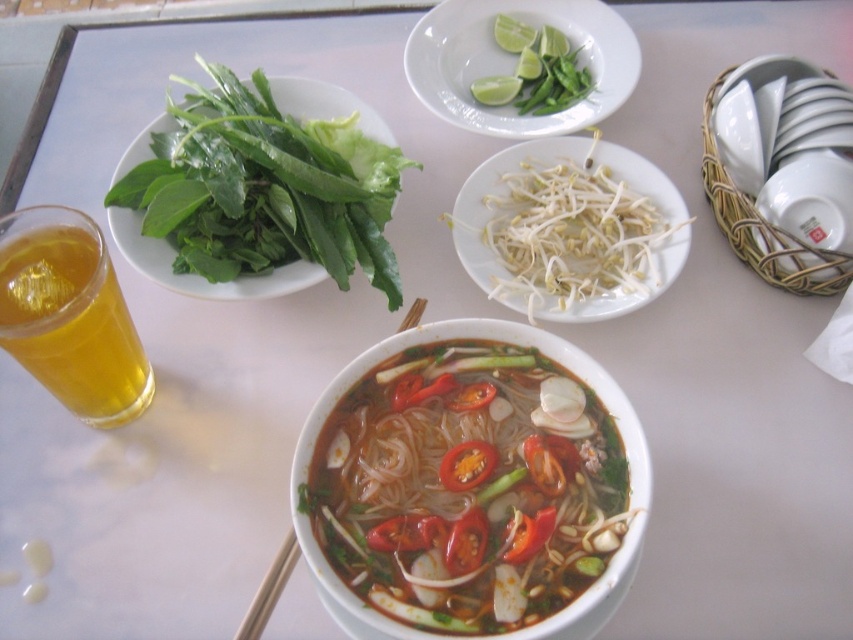
Question: Which is nearer to the translucent glass cup at lower left?

Choices:
 (A) translucent glass noodles at center
 (B) green leafy at upper center
 (C) white glossy bean sprouts at center

Answer: (A)

Question: Does green leafy at upper left appear on the right side of green matte lime and bean sprouts at upper center?

Choices:
 (A) no
 (B) yes

Answer: (A)

Question: Which of the following is the closest to the observer?

Choices:
 (A) (276, 573)
 (B) (479, 92)
 (C) (325, 561)

Answer: (C)

Question: Is white glossy bean sprouts at center to the left of green matte lime and bean sprouts at upper center from the viewer's perspective?

Choices:
 (A) yes
 (B) no

Answer: (B)

Question: Can you confirm if translucent glass cup at lower left is positioned to the right of green matte lime and bean sprouts at upper center?

Choices:
 (A) no
 (B) yes

Answer: (A)

Question: Which object is the closest to the translucent glass noodles at center?

Choices:
 (A) wooden chopsticks at center
 (B) green matte lime and bean sprouts at upper center

Answer: (A)